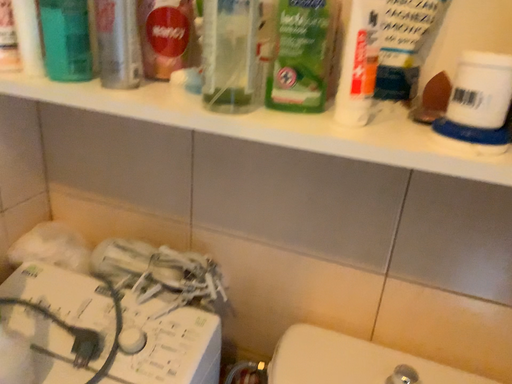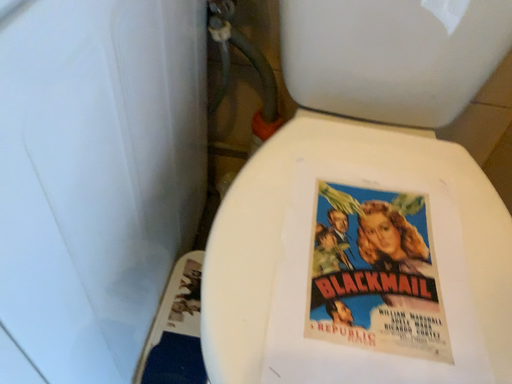
Question: How did the camera likely rotate when shooting the video?

Choices:
 (A) rotated left
 (B) rotated right

Answer: (B)